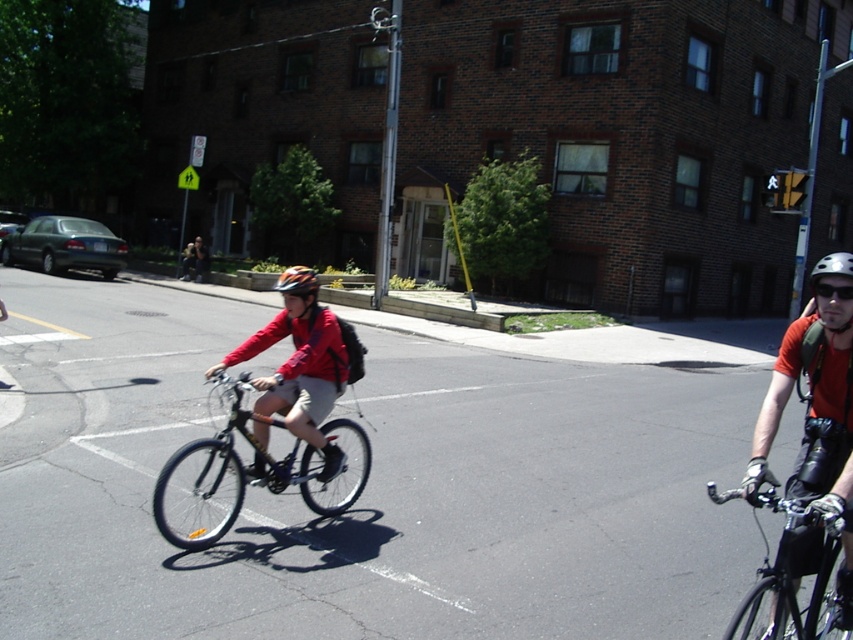
You are a delivery person who needs to deliver a package to the point marked as point (x=820, y=260). You are currently at point (x=181, y=273). According to the scene, which direction should you move to reach your destination?

You should move backward because point (x=181, y=273) is in front of point (x=820, y=260), meaning your destination is behind your current position.

You are a photographer standing on the sidewalk. You want to take a photo that includes both the orange matte helmet at center and the shiny silver helmet at upper right. Which helmet will appear smaller in the final photo?

The orange matte helmet at center will appear smaller in the final photo because it has a lesser height compared to the shiny silver helmet at upper right.